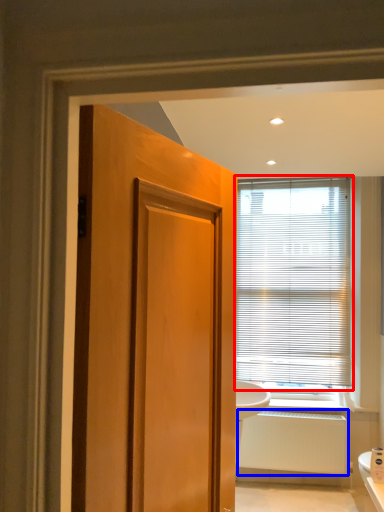
Question: Which object is further to the camera taking this photo, window blind (highlighted by a red box) or radiator (highlighted by a blue box)?

Choices:
 (A) window blind
 (B) radiator

Answer: (A)